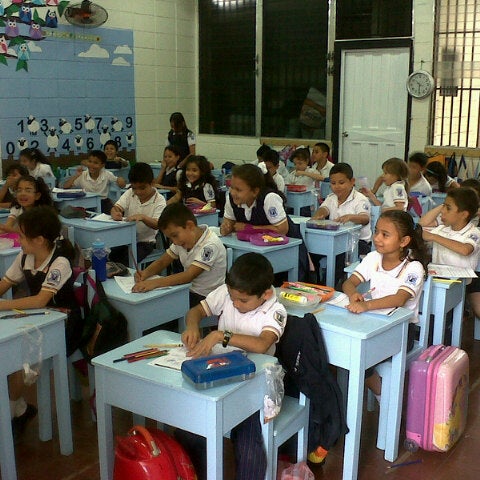
I want to click on counting sheep painted on the wall, so click(33, 124), click(64, 125), click(90, 126), click(115, 125), click(130, 140), click(105, 137), click(80, 140), click(54, 143), click(21, 145).